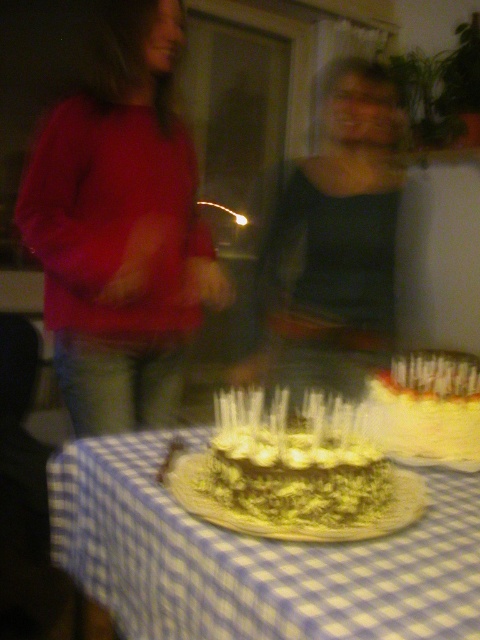
You are at a birthday party and see the matte red sweater at left and the chocolate frosted cake at center. Which object is positioned higher from the ground?

The matte red sweater at left is above the chocolate frosted cake at center, so it is positioned higher from the ground.

You are standing in front of the birthday cake with lit candles. There are two points marked on the tablecloth around the cake. One is at coordinate point (290, 568) and the other is at point (433, 388). Which point is closer to you?

Point (290, 568) is closer to the viewer than point (433, 388).

You are a guest at a birthday party and see both the chocolate frosted cake at center and the white frosted cake at center. Which cake is bigger?

The chocolate frosted cake at center is larger in size compared to the white frosted cake at center.